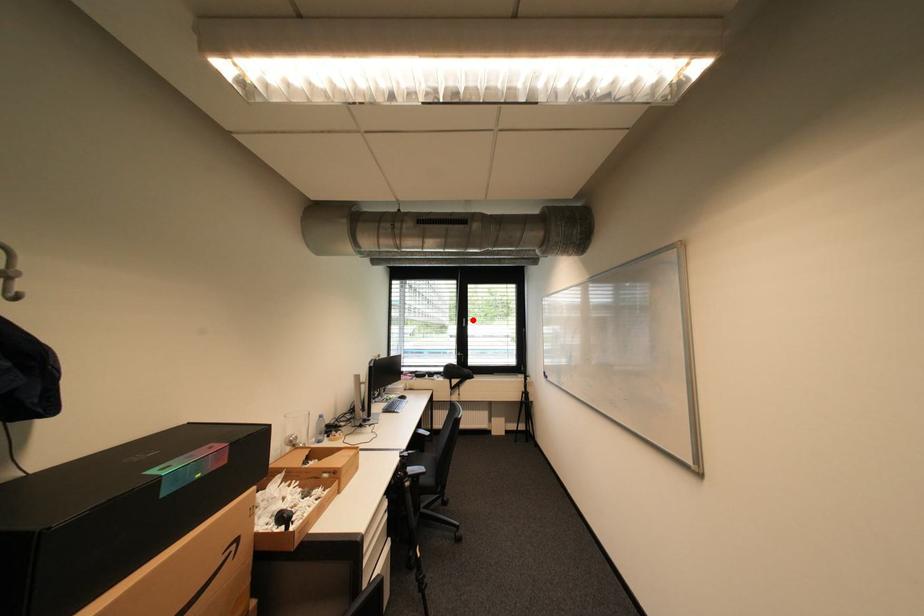
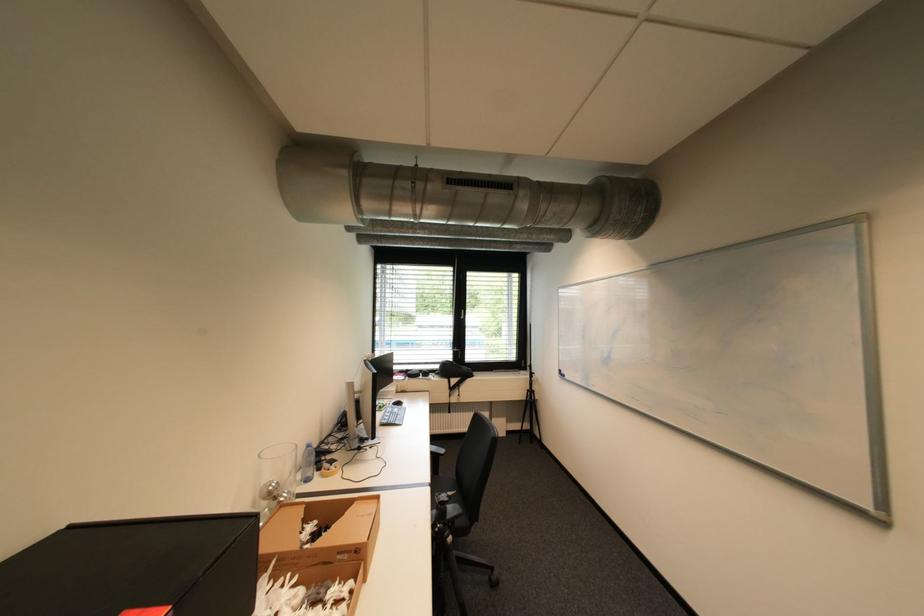
Locate, in the second image, the point that corresponds to the highlighted location in the first image.

(470, 312)